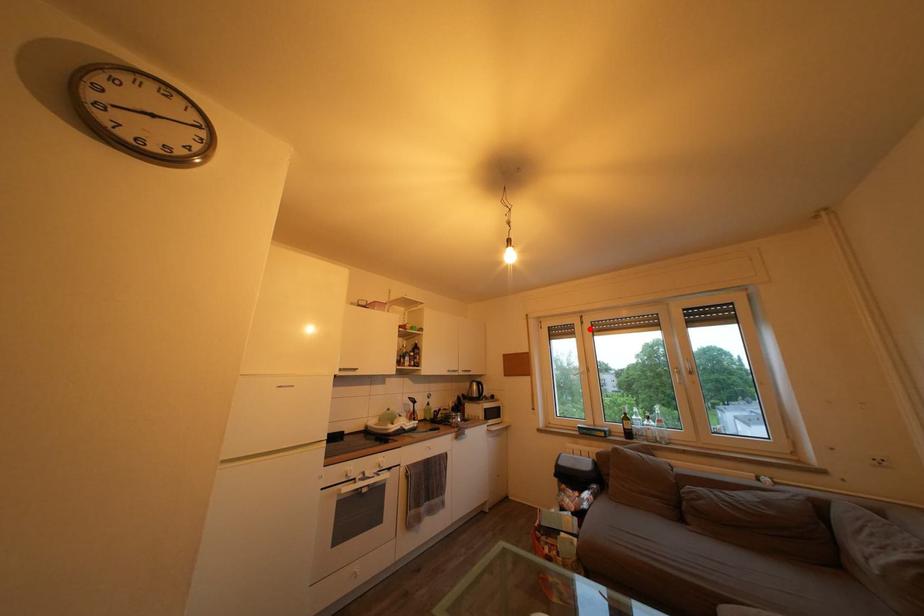
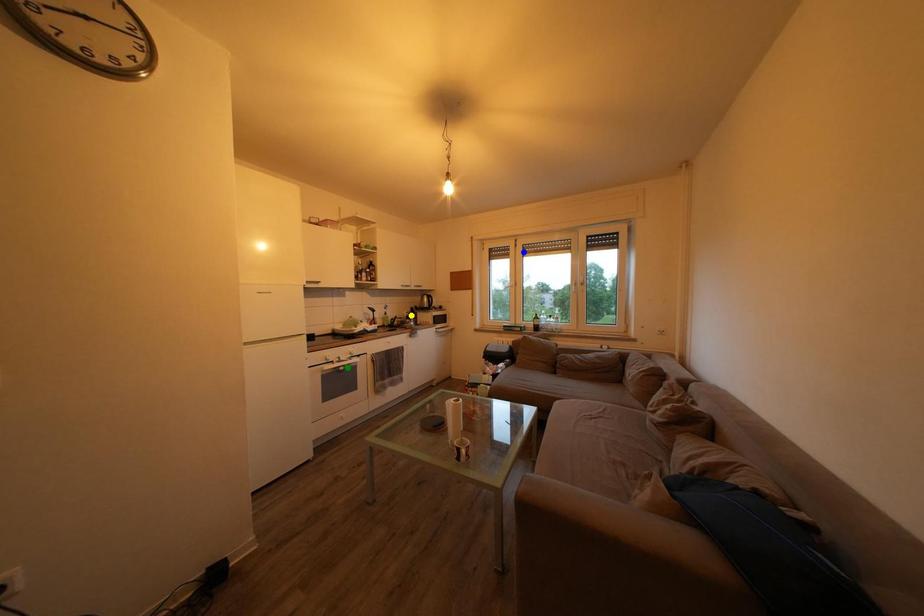
Question: I am providing you with two images of the same scene from different viewpoints. A red point is marked on the first image. You are given multiple points on the second image. Which point in image 2 represents the same 3d spot as the red point in image 1?

Choices:
 (A) green point
 (B) blue point
 (C) yellow point

Answer: (B)